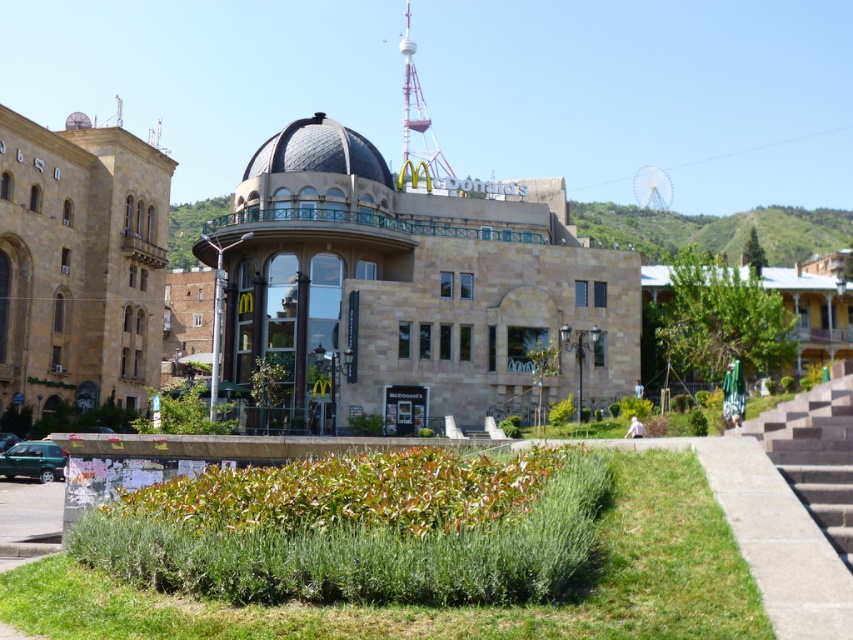
Does concrete stairs at right appear on the right side of shiny metallic dome at center?

Indeed, concrete stairs at right is positioned on the right side of shiny metallic dome at center.

You are a GUI agent. You are given a task and a screenshot of the screen. Output one action in this format:
    pyautogui.click(x=<x>, y=<y>)
    Task: Click on the concrete stairs at right
    The width and height of the screenshot is (853, 640).
    Given the screenshot: What is the action you would take?
    pyautogui.click(x=815, y=451)